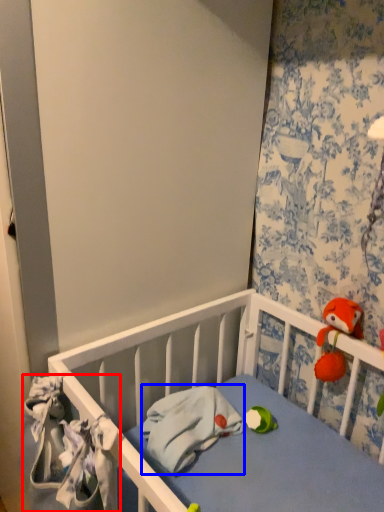
Question: Which object appears farthest to the camera in this image, material (highlighted by a red box) or material (highlighted by a blue box)?

Choices:
 (A) material
 (B) material

Answer: (B)